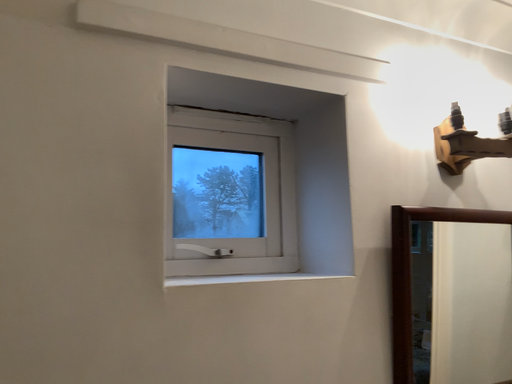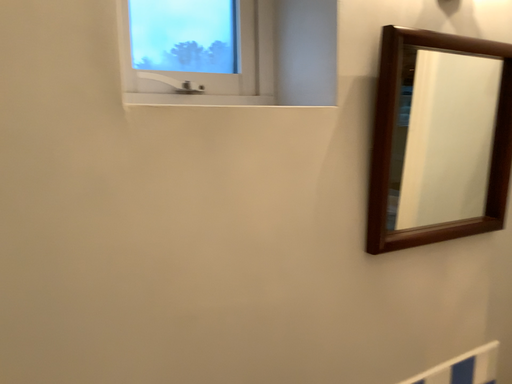
Question: How did the camera likely rotate when shooting the video?

Choices:
 (A) rotated downward
 (B) rotated upward

Answer: (A)